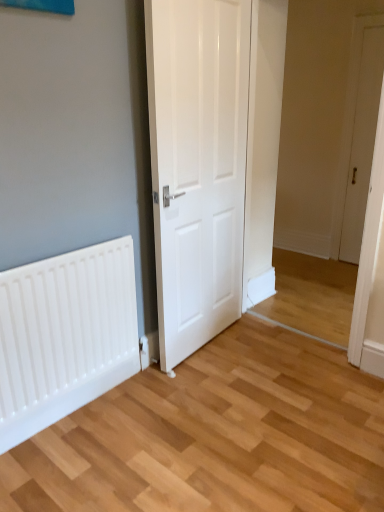
Identify the location of blank area beneath white glossy door at center, positioned as the first door in front-to-back order (from a real-world perspective). The image size is (384, 512). (213, 340).